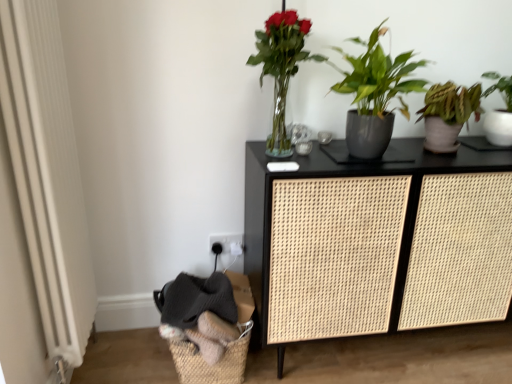
Question: Can you confirm if woven natural basket at lower left is bigger than translucent glass vase at upper center, which is counted as the third houseplant, starting from the right?

Choices:
 (A) no
 (B) yes

Answer: (B)

Question: Would you say woven natural basket at lower left is outside translucent glass vase at upper center, which is counted as the third houseplant, starting from the right?

Choices:
 (A) no
 (B) yes

Answer: (B)

Question: From a real-world perspective, is woven natural basket at lower left beneath translucent glass vase at upper center, which is counted as the third houseplant, starting from the right?

Choices:
 (A) no
 (B) yes

Answer: (B)

Question: Is woven natural basket at lower left positioned with its back to translucent glass vase at upper center, which ranks as the first houseplant in left-to-right order?

Choices:
 (A) yes
 (B) no

Answer: (B)

Question: Is woven natural basket at lower left at the right side of translucent glass vase at upper center, which is counted as the third houseplant, starting from the right?

Choices:
 (A) no
 (B) yes

Answer: (A)

Question: From the image's perspective, is green matte plant at right, which appears as the third houseplant when viewed from the left, above or below woven natural basket at lower left?

Choices:
 (A) above
 (B) below

Answer: (A)

Question: In terms of width, does green matte plant at right, positioned as the first houseplant in right-to-left order, look wider or thinner when compared to woven natural basket at lower left?

Choices:
 (A) wide
 (B) thin

Answer: (B)

Question: In terms of size, does green matte plant at right, positioned as the first houseplant in right-to-left order, appear bigger or smaller than woven natural basket at lower left?

Choices:
 (A) small
 (B) big

Answer: (A)

Question: Is point (490, 130) positioned closer to the camera than point (180, 347)?

Choices:
 (A) closer
 (B) farther

Answer: (B)

Question: Is woven natural basket at lower left situated inside translucent glass vase at upper center, which is counted as the third houseplant, starting from the right, or outside?

Choices:
 (A) inside
 (B) outside

Answer: (B)

Question: Would you say woven natural basket at lower left is to the left or to the right of translucent glass vase at upper center, which is counted as the third houseplant, starting from the right, in the picture?

Choices:
 (A) left
 (B) right

Answer: (A)

Question: From the image's perspective, is woven natural basket at lower left located above or below translucent glass vase at upper center, which is counted as the third houseplant, starting from the right?

Choices:
 (A) below
 (B) above

Answer: (A)

Question: In the image, is woven natural basket at lower left positioned in front of or behind translucent glass vase at upper center, which is counted as the third houseplant, starting from the right?

Choices:
 (A) front
 (B) behind

Answer: (B)

Question: Is black rattan cabinet at center taller or shorter than white textured radiator at left?

Choices:
 (A) short
 (B) tall

Answer: (A)

Question: From a real-world perspective, is black rattan cabinet at center positioned above or below white textured radiator at left?

Choices:
 (A) below
 (B) above

Answer: (A)